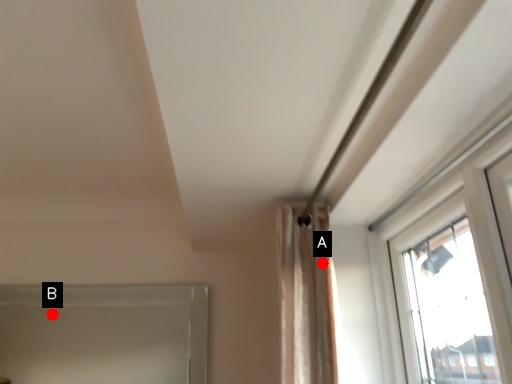
Question: Two points are circled on the image, labeled by A and B beside each circle. Among these points, which one is farthest from the camera?

Choices:
 (A) A is further
 (B) B is further

Answer: (B)